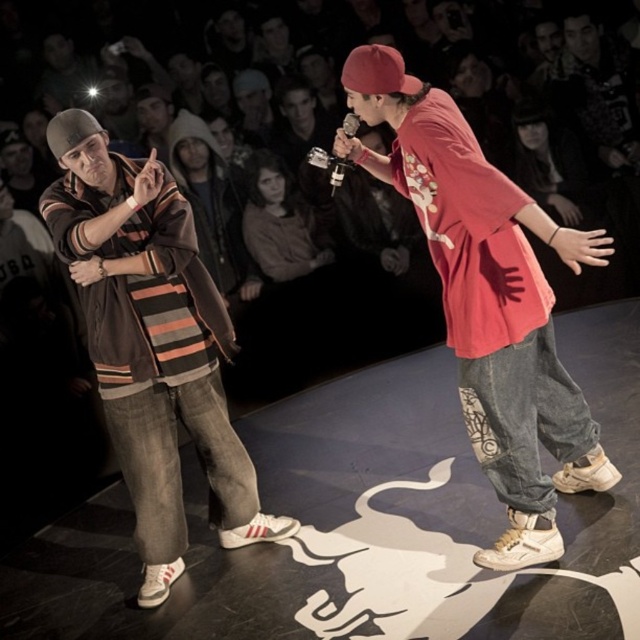
You are a photographer at a rap battle event. You need to capture a photo where both the striped cotton shirt at left and the red cotton baseball cap at upper center are clearly visible. Based on their sizes, which object should you focus on first to ensure both are in frame?

The striped cotton shirt at left is taller than the red cotton baseball cap at upper center, so you should focus on the striped cotton shirt at left first to ensure both are in frame since it is larger and requires more space.

You are a photographer at a rap battle event. You need to capture a photo where the matte red shirt at center and the striped cotton shirt at left are both visible. Based on their positions, which shirt should you focus on to ensure both are in frame?

The matte red shirt at center is above the striped cotton shirt at left, so focusing on the matte red shirt at center will ensure both are visible in the photo.

You are a photographer at a rap battle. You need to capture both the performer on the left and the one on the right in a single shot. The camera you have can only focus on objects within a 0.5 unit distance from the center. Given the positions of the two performers represented by their coordinates, point (499, 406) and point (353, 81), will both performers be in focus if you center the camera on the midpoint between them?

The distance between point (499, 406) and point (353, 81) is calculated using the distance formula. The midpoint between them is at the average of their coordinates. If the maximum focus range of 0.5 units from the center encompasses both points, then yes. Otherwise, no. However, according to the objects description, point (499, 406) is behind point (353, 81), which might indicate their depth rather than 2D position. Since the question is about 2D focus distance, the depth information might not be